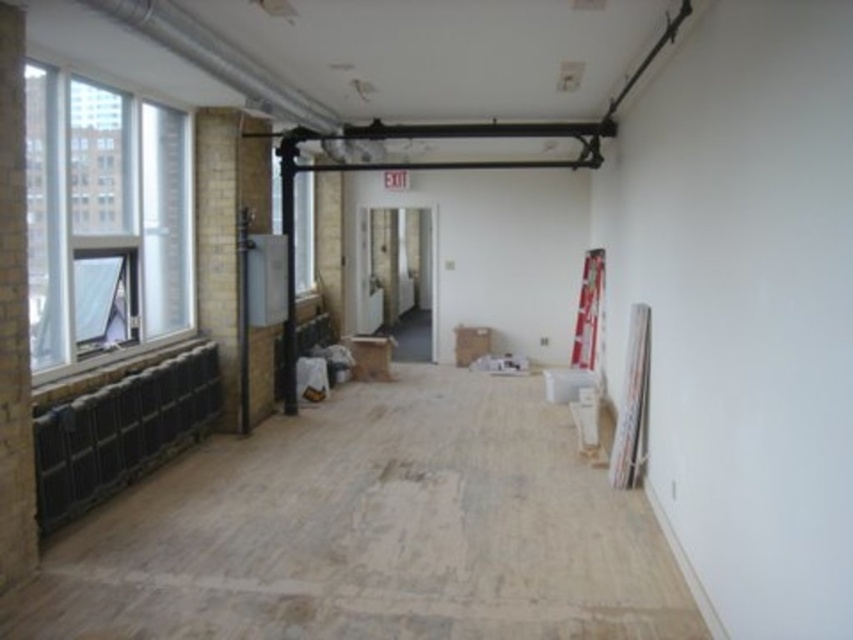
Can you confirm if clear glass window at left is thinner than clear glass window at center?

Incorrect, clear glass window at left's width is not less than clear glass window at center's.

Is point (84, 269) positioned after point (297, 225)?

No, it is not.

Identify the location of clear glass window at left. (103, 218).

Consider the image. Can you confirm if clear glass window at left is positioned to the right of brick wall at left?

In fact, clear glass window at left is to the left of brick wall at left.

Between point (158, 269) and point (0, 515), which one is positioned behind?

Positioned behind is point (158, 269).

The width and height of the screenshot is (853, 640). What are the coordinates of `clear glass window at left` in the screenshot? It's located at (103, 218).

What do you see at coordinates (15, 316) in the screenshot? The image size is (853, 640). I see `brick wall at left` at bounding box center [15, 316].

Looking at this image, is brick wall at left bigger than clear glass window at center?

Actually, brick wall at left might be smaller than clear glass window at center.

Which is behind, point (7, 394) or point (312, 224)?

The point (312, 224) is behind.

Find the location of a particular element. This screenshot has width=853, height=640. brick wall at left is located at coordinates (15, 316).